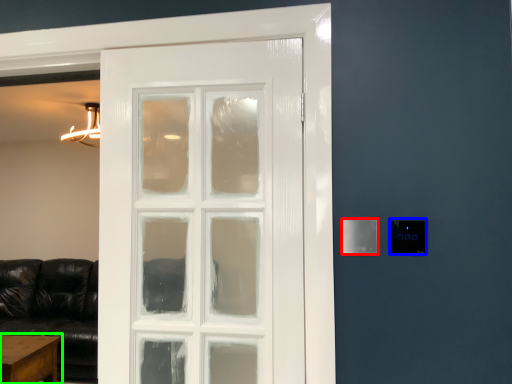
Question: Estimate the real-world distances between objects in this image. Which object is closer to light switch (highlighted by a red box), light switch (highlighted by a blue box) or table (highlighted by a green box)?

Choices:
 (A) light switch
 (B) table

Answer: (A)